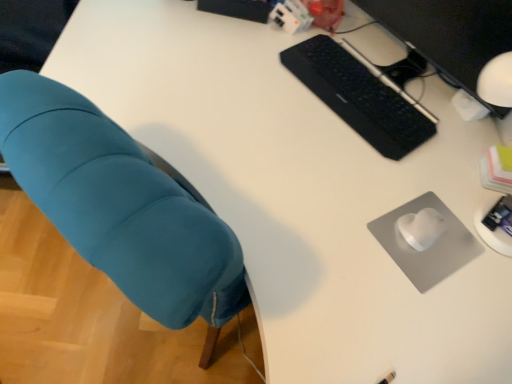
Where is `vacant space situated on the left part of gray matte mousepad at lower right`? vacant space situated on the left part of gray matte mousepad at lower right is located at coordinates (347, 218).